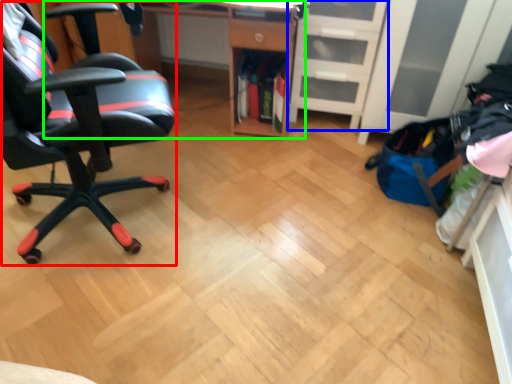
Question: Estimate the real-world distances between objects in this image. Which object is farther from chair (highlighted by a red box), file cabinet (highlighted by a blue box) or desk (highlighted by a green box)?

Choices:
 (A) file cabinet
 (B) desk

Answer: (A)